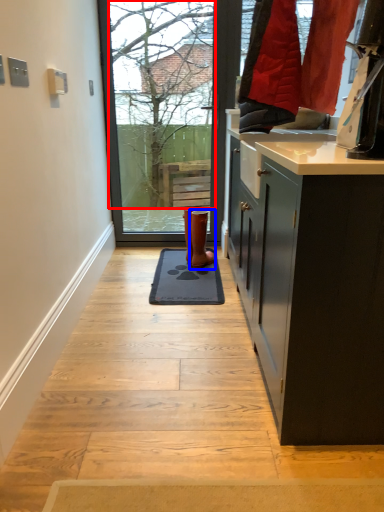
Question: Which of the following is the closest to the observer, tree (highlighted by a red box) or footwear (highlighted by a blue box)?

Choices:
 (A) tree
 (B) footwear

Answer: (B)